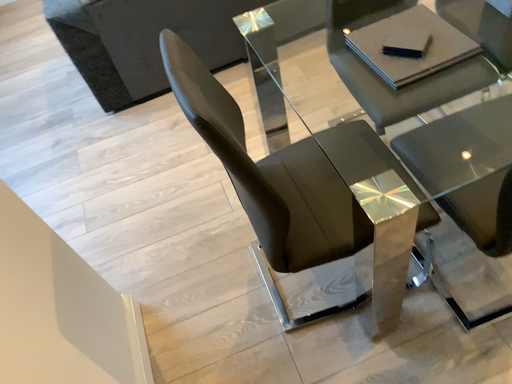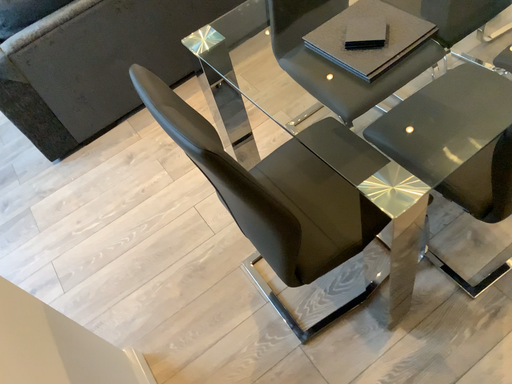
Question: Which way did the camera rotate in the video?

Choices:
 (A) rotated left
 (B) rotated right

Answer: (B)